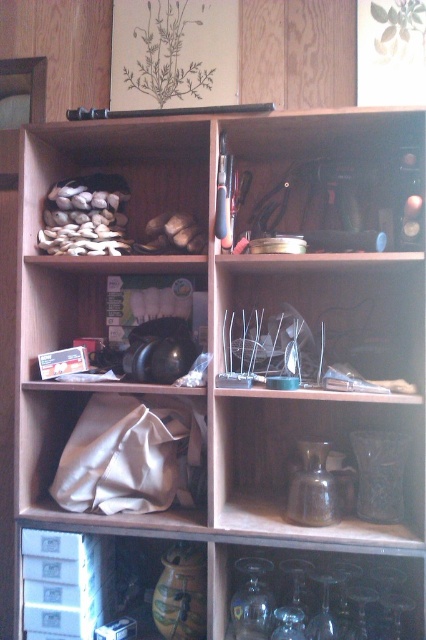
Question: Estimate the real-world distances between objects in this image. Which object is closer to the white fabric at lower left?

Choices:
 (A) white matte shells at upper left
 (B) clear glass cups at center
 (C) matte black headphones at center

Answer: (C)

Question: Can you confirm if clear glass cups at center is positioned to the left of white matte shells at upper left?

Choices:
 (A) yes
 (B) no

Answer: (B)

Question: Can you confirm if white fabric at lower left is thinner than clear glass cups at center?

Choices:
 (A) no
 (B) yes

Answer: (B)

Question: Among these points, which one is farthest from the camera?

Choices:
 (A) (204, 212)
 (B) (121, 264)
 (C) (391, 326)
 (D) (146, 504)

Answer: (A)

Question: Which of the following is the farthest from the observer?

Choices:
 (A) clear glass cups at center
 (B) white matte shells at upper left
 (C) matte black headphones at center
 (D) matte glass vase at center

Answer: (C)

Question: Can you confirm if matte glass vase at center is positioned to the right of matte black headphones at center?

Choices:
 (A) yes
 (B) no

Answer: (A)